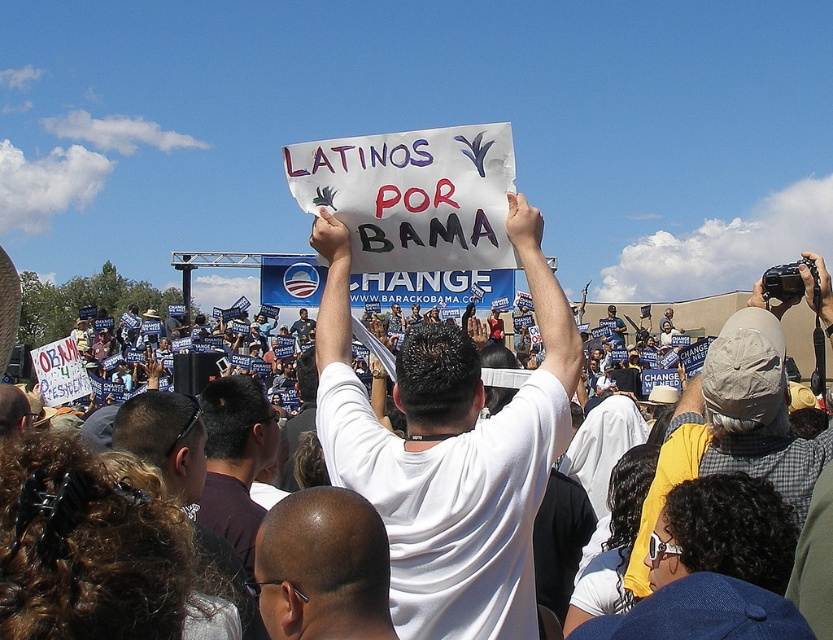
Looking at this image, which is above, gray baseball cap at upper right or bald head at center?

gray baseball cap at upper right

Who is more distant from viewer, (677, 472) or (372, 557)?

The point (677, 472) is more distant.

This screenshot has height=640, width=833. In order to click on gray baseball cap at upper right in this screenshot , I will do pyautogui.click(x=732, y=428).

Who is positioned more to the right, gray baseball cap at upper right or dark brown shirt at center?

Positioned to the right is gray baseball cap at upper right.

Is gray baseball cap at upper right below dark brown shirt at center?

Incorrect, gray baseball cap at upper right is not positioned below dark brown shirt at center.

You are a GUI agent. You are given a task and a screenshot of the screen. Output one action in this format:
    pyautogui.click(x=<x>, y=<y>)
    Task: Click on the gray baseball cap at upper right
    This screenshot has height=640, width=833.
    Given the screenshot: What is the action you would take?
    pyautogui.click(x=732, y=428)

Is white matte shirt at center to the left of bald head at center from the viewer's perspective?

Incorrect, white matte shirt at center is not on the left side of bald head at center.

Is white matte shirt at center taller than bald head at center?

Correct, white matte shirt at center is much taller as bald head at center.

Between point (552, 429) and point (388, 561), which one is positioned in front?

Point (388, 561) is more forward.

The height and width of the screenshot is (640, 833). Find the location of `white matte shirt at center`. white matte shirt at center is located at coordinates (450, 451).